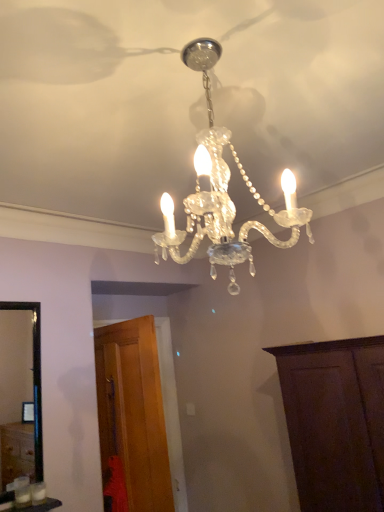
Question: Is clear crystal chandelier at center not close to wooden door at lower left, the first cabinetry viewed from the left?

Choices:
 (A) yes
 (B) no

Answer: (A)

Question: Can you confirm if clear crystal chandelier at center is wider than wooden door at lower left, the first cabinetry viewed from the left?

Choices:
 (A) no
 (B) yes

Answer: (B)

Question: Can you confirm if clear crystal chandelier at center is smaller than wooden door at lower left, acting as the 2th cabinetry starting from the right?

Choices:
 (A) no
 (B) yes

Answer: (B)

Question: Is clear crystal chandelier at center next to wooden door at lower left, acting as the 2th cabinetry starting from the right?

Choices:
 (A) yes
 (B) no

Answer: (B)

Question: Is clear crystal chandelier at center bigger than wooden door at lower left, the first cabinetry viewed from the left?

Choices:
 (A) no
 (B) yes

Answer: (A)

Question: In terms of height, does clear crystal chandelier at center look taller or shorter compared to wooden door at lower left, acting as the 2th cabinetry starting from the right?

Choices:
 (A) tall
 (B) short

Answer: (B)

Question: Based on their positions, is clear crystal chandelier at center located to the left or right of wooden door at lower left, the first cabinetry viewed from the left?

Choices:
 (A) left
 (B) right

Answer: (B)

Question: From the image's perspective, is clear crystal chandelier at center above or below wooden door at lower left, acting as the 2th cabinetry starting from the right?

Choices:
 (A) above
 (B) below

Answer: (A)

Question: Is point (228, 202) positioned closer to the camera than point (160, 490)?

Choices:
 (A) closer
 (B) farther

Answer: (A)

Question: Considering the positions of wooden door at lower left, acting as the 2th cabinetry starting from the right, and clear crystal chandelier at center in the image, is wooden door at lower left, acting as the 2th cabinetry starting from the right, wider or thinner than clear crystal chandelier at center?

Choices:
 (A) wide
 (B) thin

Answer: (B)

Question: Considering the positions of wooden door at lower left, the first cabinetry viewed from the left, and clear crystal chandelier at center in the image, is wooden door at lower left, the first cabinetry viewed from the left, bigger or smaller than clear crystal chandelier at center?

Choices:
 (A) big
 (B) small

Answer: (A)

Question: In the image, is wooden door at lower left, the first cabinetry viewed from the left, on the left side or the right side of clear crystal chandelier at center?

Choices:
 (A) right
 (B) left

Answer: (B)

Question: Is wooden door at lower left, the first cabinetry viewed from the left, taller or shorter than clear crystal chandelier at center?

Choices:
 (A) tall
 (B) short

Answer: (A)

Question: Relative to dark wood cabinet at lower right, the 2th cabinetry when ordered from left to right, is clear crystal chandelier at center in front or behind?

Choices:
 (A) front
 (B) behind

Answer: (A)

Question: Based on their positions, is clear crystal chandelier at center located to the left or right of dark wood cabinet at lower right, which is counted as the first cabinetry, starting from the right?

Choices:
 (A) right
 (B) left

Answer: (B)